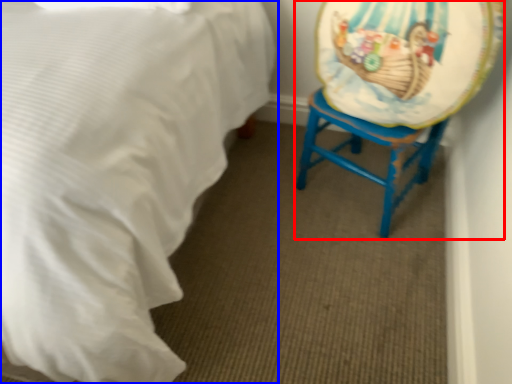
Question: Which point is further to the camera, swivel chair (highlighted by a red box) or bed (highlighted by a blue box)?

Choices:
 (A) swivel chair
 (B) bed

Answer: (A)